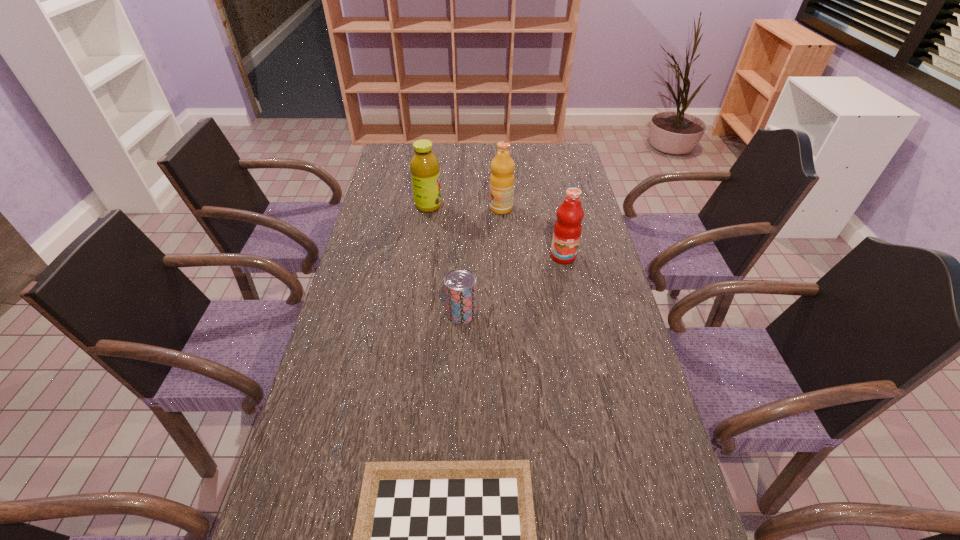
This screenshot has height=540, width=960. In order to click on the second fruit juice from left to right in this screenshot , I will do `click(502, 166)`.

The height and width of the screenshot is (540, 960). Identify the location of the leftmost fruit juice. (424, 165).

Where is `the rightmost object`? the rightmost object is located at coordinates (567, 230).

Where is `the rightmost fruit juice`? the rightmost fruit juice is located at coordinates (567, 230).

Where is `beer can`? The width and height of the screenshot is (960, 540). beer can is located at coordinates [x=460, y=284].

The image size is (960, 540). Identify the location of the second shortest object. click(x=460, y=284).

Locate an element on the screen. vacant space located 0.230m on the front label of the second fruit juice from left to right is located at coordinates (425, 208).

The height and width of the screenshot is (540, 960). Identify the location of free space located on the front label of the second fruit juice from left to right. (422, 208).

Locate an element on the screen. This screenshot has height=540, width=960. vacant space located 0.150m on the front label of the second fruit juice from left to right is located at coordinates (447, 208).

Locate an element on the screen. This screenshot has height=540, width=960. vacant space located 0.100m on the front label of the leftmost fruit juice is located at coordinates (470, 206).